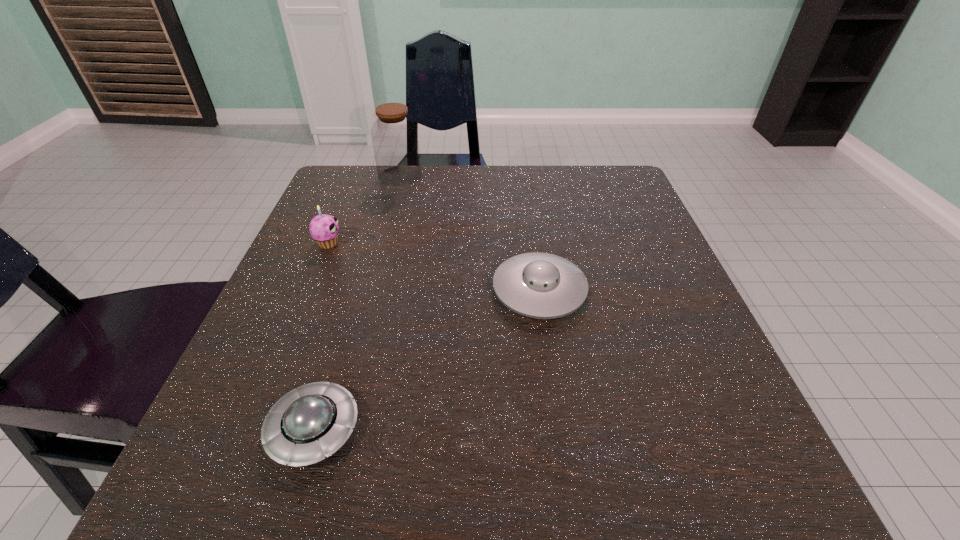
You are a GUI agent. You are given a task and a screenshot of the screen. Output one action in this format:
    pyautogui.click(x=<x>, y=<y>)
    Task: Click on the free space in the image that satisfies the following two spatial constraints: 1. on the face of the left saucer; 2. on the left side of the cupcake
    This screenshot has width=960, height=540.
    Given the screenshot: What is the action you would take?
    pyautogui.click(x=251, y=429)